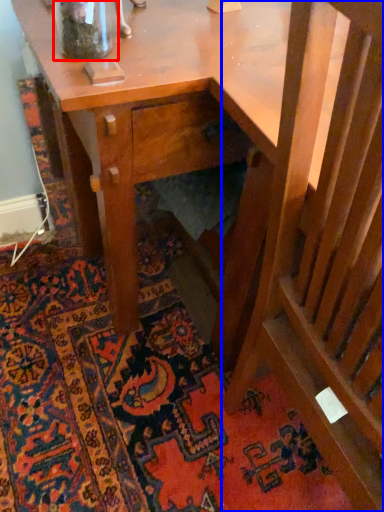
Question: Which of the following is the closest to the observer, glass vase (highlighted by a red box) or rocking chair (highlighted by a blue box)?

Choices:
 (A) glass vase
 (B) rocking chair

Answer: (B)